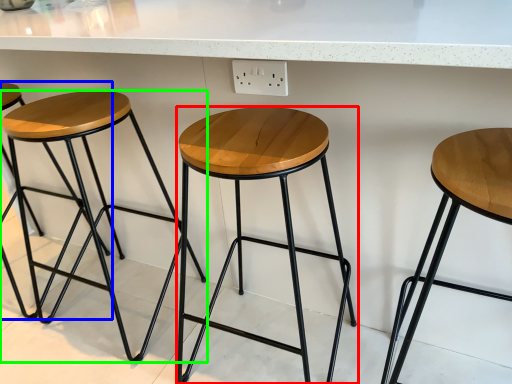
Question: Which object is positioned farthest from stool (highlighted by a red box)? Select from stool (highlighted by a blue box) and stool (highlighted by a green box).

Choices:
 (A) stool
 (B) stool

Answer: (A)